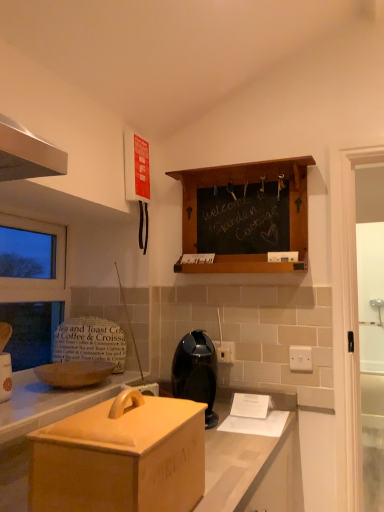
Question: Is transparent glass window at left bigger or smaller than matte wooden bread bin at lower left?

Choices:
 (A) small
 (B) big

Answer: (B)

Question: Is point (43, 241) positioned closer to the camera than point (281, 397)?

Choices:
 (A) closer
 (B) farther

Answer: (B)

Question: Estimate the real-world distances between objects in this image. Which object is farther from the white plastic electric outlet at center, which appears as the first electric outlet when viewed from the left?

Choices:
 (A) black plastic coffee maker at center
 (B) matte wooden bread bin at lower left
 (C) wooden chalkboard at center
 (D) transparent glass door at right
 (E) transparent glass window at left

Answer: (E)

Question: Which object is the closest to the black plastic coffee maker at center?

Choices:
 (A) transparent glass door at right
 (B) matte wooden bread bin at lower left
 (C) transparent glass window at left
 (D) wooden chalkboard at center
 (E) white plastic electric outlet at center, positioned as the 1th electric outlet in back-to-front order

Answer: (B)